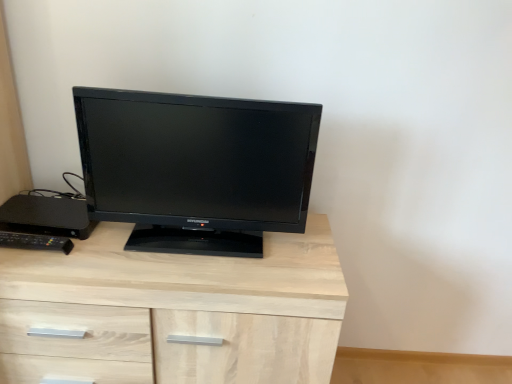
Where is `vacant area situated below black glossy monitor at center (from a real-world perspective)`? This screenshot has height=384, width=512. vacant area situated below black glossy monitor at center (from a real-world perspective) is located at coordinates tap(198, 240).